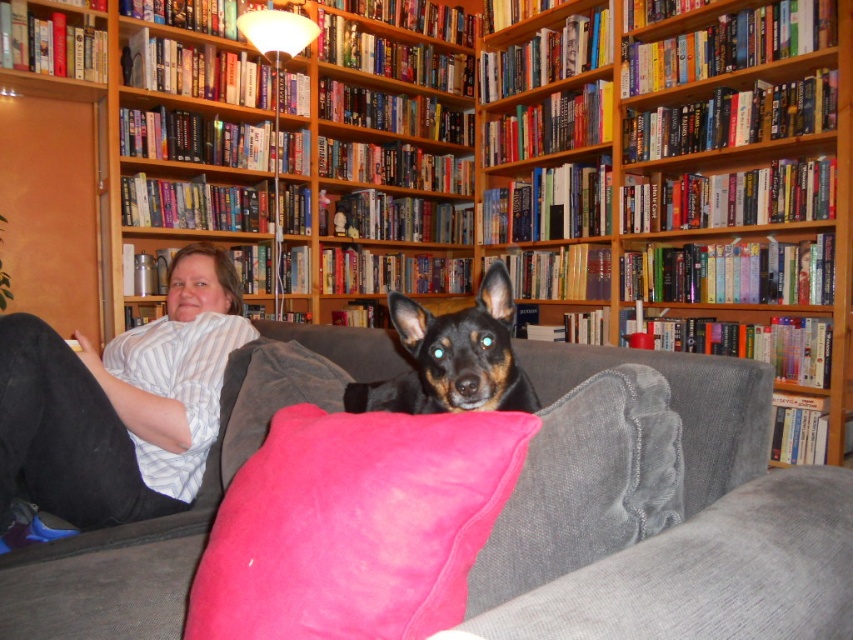
Question: Which is nearer to the black smooth dog at center?

Choices:
 (A) gray fabric couch at center
 (B) pink velvety pillow at center
 (C) wooden bookshelf at upper center

Answer: (A)

Question: Is wooden bookshelf at upper center smaller than pink velvety pillow at center?

Choices:
 (A) yes
 (B) no

Answer: (B)

Question: Which object is closer to the camera taking this photo?

Choices:
 (A) white striped shirt at center
 (B) gray fabric couch at center
 (C) pink velvety pillow at center
 (D) wooden bookshelf at upper center

Answer: (B)

Question: Is velvet pink pillow at center positioned before white striped shirt at center?

Choices:
 (A) no
 (B) yes

Answer: (B)

Question: In this image, where is velvet pink pillow at center located relative to white striped shirt at center?

Choices:
 (A) below
 (B) above

Answer: (A)

Question: Estimate the real-world distances between objects in this image. Which object is closer to the wooden bookshelf at upper center?

Choices:
 (A) pink velvety pillow at center
 (B) black smooth dog at center
 (C) gray fabric couch at center
 (D) velvet pink pillow at center

Answer: (B)